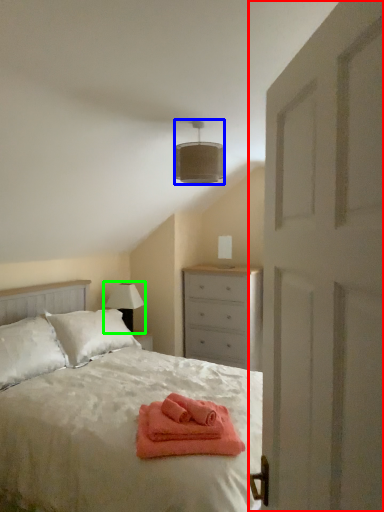
Question: Which object is the closest to the door (highlighted by a red box)? Choose among these: lamp (highlighted by a blue box) or table lamp (highlighted by a green box).

Choices:
 (A) lamp
 (B) table lamp

Answer: (A)